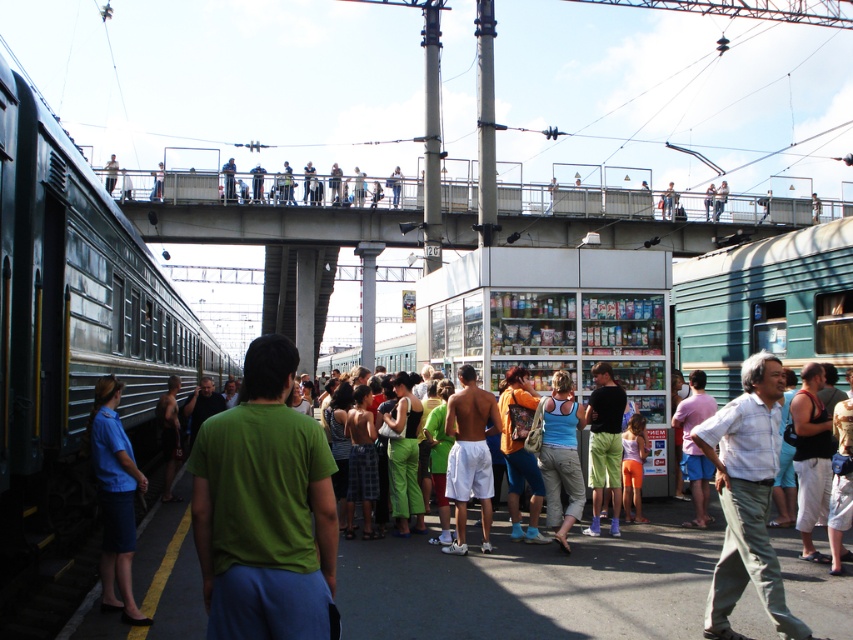
Is green matte train at left bigger than blue fabric shirt at left?

Correct, green matte train at left is larger in size than blue fabric shirt at left.

Does point (38, 529) lie behind point (122, 557)?

That is True.

Is point (73, 376) positioned after point (122, 518)?

Yes, point (73, 376) is behind point (122, 518).

Find the location of `green matte train at left`. green matte train at left is located at coordinates [x=71, y=321].

Is point (36, 419) closer to viewer compared to point (625, 564)?

Yes, point (36, 419) is closer to viewer.

This screenshot has width=853, height=640. I want to click on green matte train at left, so click(x=71, y=321).

What do you see at coordinates (71, 321) in the screenshot? The image size is (853, 640). I see `green matte train at left` at bounding box center [71, 321].

This screenshot has height=640, width=853. What are the coordinates of `green matte train at left` in the screenshot? It's located at pyautogui.click(x=71, y=321).

Is green cotton shirt at center closer to the viewer compared to blue fabric shirt at left?

No, green cotton shirt at center is behind blue fabric shirt at left.

Which of these two, green cotton shirt at center or blue fabric shirt at left, stands shorter?

green cotton shirt at center is shorter.

You are a GUI agent. You are given a task and a screenshot of the screen. Output one action in this format:
    pyautogui.click(x=<x>, y=<y>)
    Task: Click on the green cotton shirt at center
    The width and height of the screenshot is (853, 640).
    Given the screenshot: What is the action you would take?
    pyautogui.click(x=534, y=582)